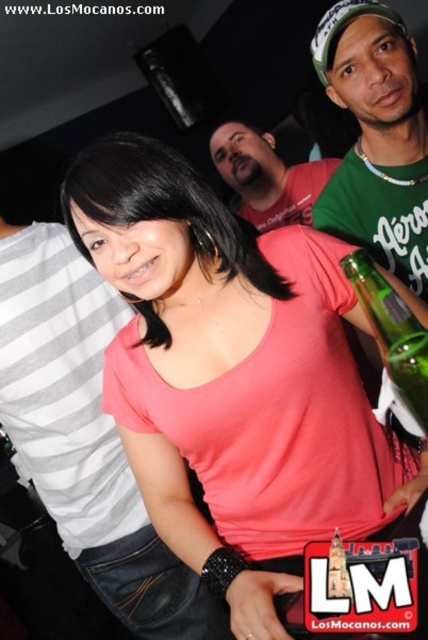
Between pink fabric shirt at center and green glass bottle at right, which one has more height?

With more height is pink fabric shirt at center.

Who is shorter, pink fabric shirt at center or green glass bottle at right?

green glass bottle at right

I want to click on pink fabric shirt at center, so click(267, 177).

Does pink matte shirt at center lie behind green matte shirt at upper right?

No, it is not.

Between point (189, 388) and point (353, 109), which one is positioned behind?

The point (353, 109) is behind.

Between point (305, 464) and point (389, 13), which one is positioned behind?

The point (389, 13) is more distant.

You are a GUI agent. You are given a task and a screenshot of the screen. Output one action in this format:
    pyautogui.click(x=<x>, y=<y>)
    Task: Click on the pink matte shirt at center
    Image resolution: width=428 pixels, height=640 pixels.
    Given the screenshot: What is the action you would take?
    pyautogui.click(x=232, y=378)

Which is more to the right, green matte shirt at upper right or green glass bottle at right?

green matte shirt at upper right

Between green matte shirt at upper right and green glass bottle at right, which one is positioned higher?

green matte shirt at upper right

Is point (392, 212) closer to camera compared to point (362, 266)?

No, (392, 212) is behind (362, 266).

Where is `green matte shirt at upper right`? green matte shirt at upper right is located at coordinates (376, 138).